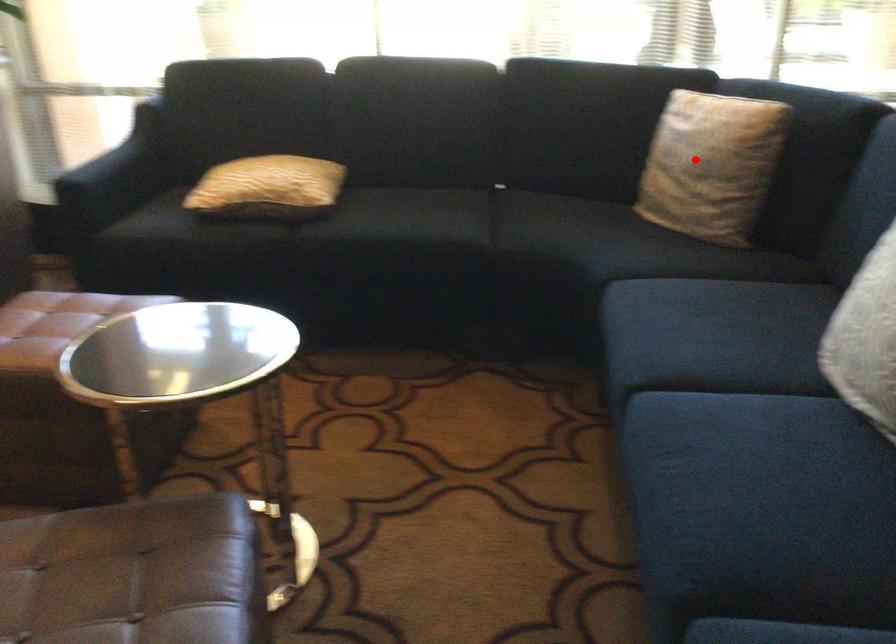
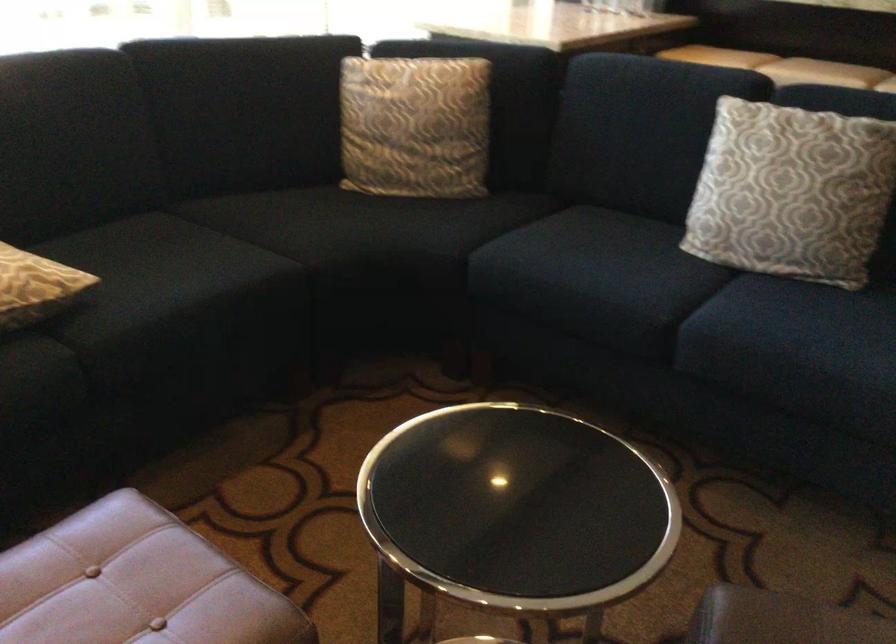
Question: I am providing you with two images of the same scene from different viewpoints. A red point is marked on the first image. At the location where the point appears in image 1, is it still visible in image 2?

Choices:
 (A) Yes
 (B) No

Answer: (A)